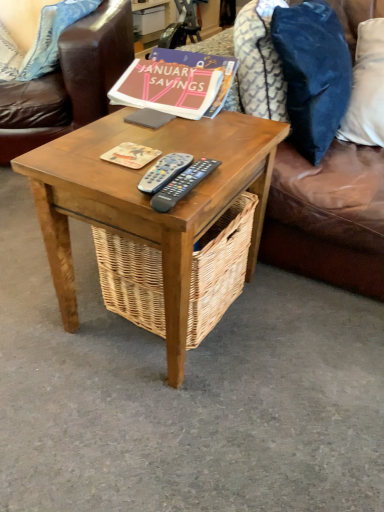
Find the location of a particular element. This screenshot has height=512, width=384. vacant space to the left of black plastic remote control at center, the second remote control viewed from the left is located at coordinates (111, 168).